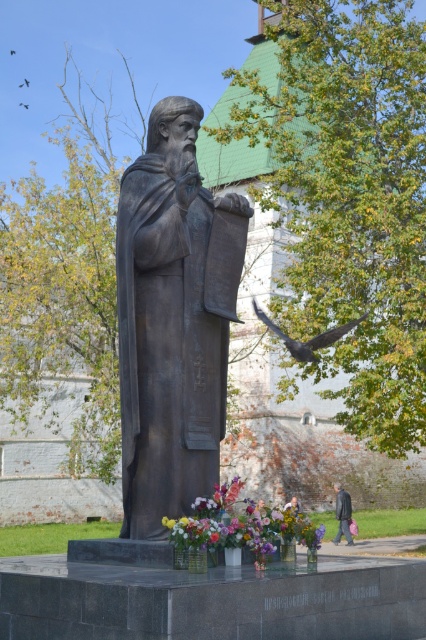
Question: Is bronze statue at center further to camera compared to vibrant floral bouquet at center?

Choices:
 (A) yes
 (B) no

Answer: (A)

Question: Which point appears closest to the camera in this image?

Choices:
 (A) (339, 483)
 (B) (166, 332)

Answer: (B)

Question: Is bronze statue at center positioned before dark gray coat at lower right?

Choices:
 (A) no
 (B) yes

Answer: (B)

Question: Which is nearer to the vibrant floral bouquet at center?

Choices:
 (A) bronze statue at center
 (B) dark gray coat at lower right

Answer: (A)

Question: In this image, where is bronze statue at center located relative to dark gray coat at lower right?

Choices:
 (A) above
 (B) below

Answer: (A)

Question: Considering the real-world distances, which object is farthest from the dark gray coat at lower right?

Choices:
 (A) bronze statue at center
 (B) vibrant floral bouquet at center

Answer: (A)